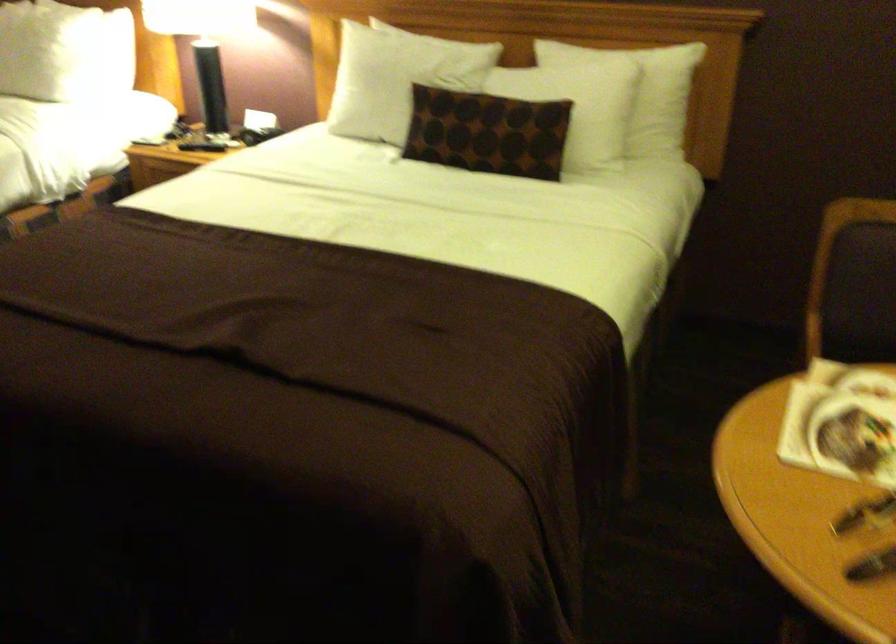
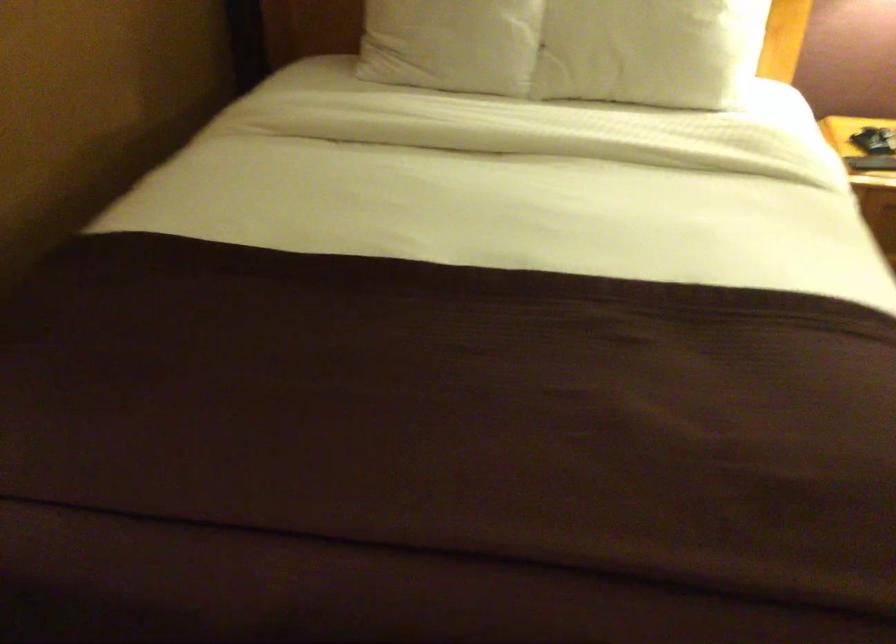
Looking at this image, in a continuous first-person perspective shot, in which direction is the camera moving?

The movement direction of the cameraman is left, forward.